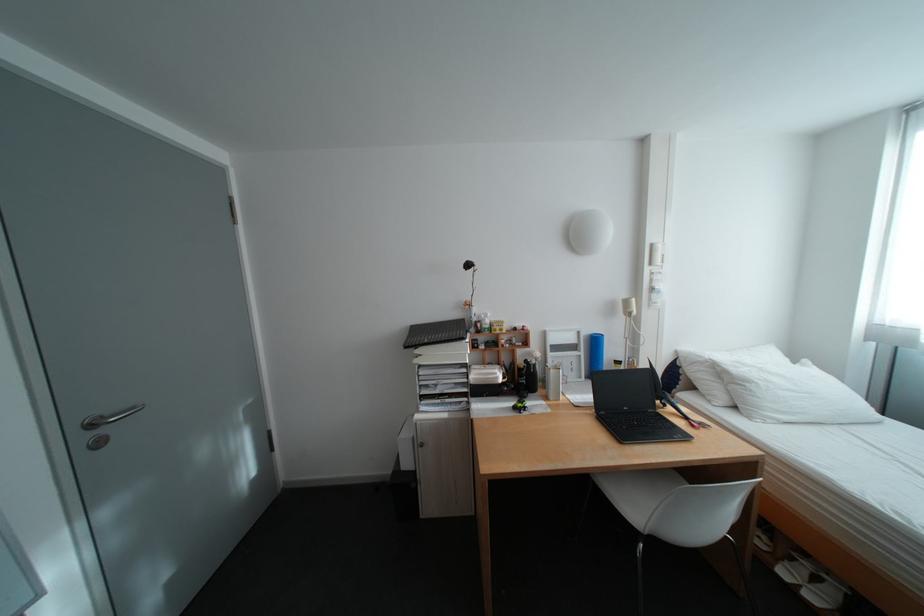
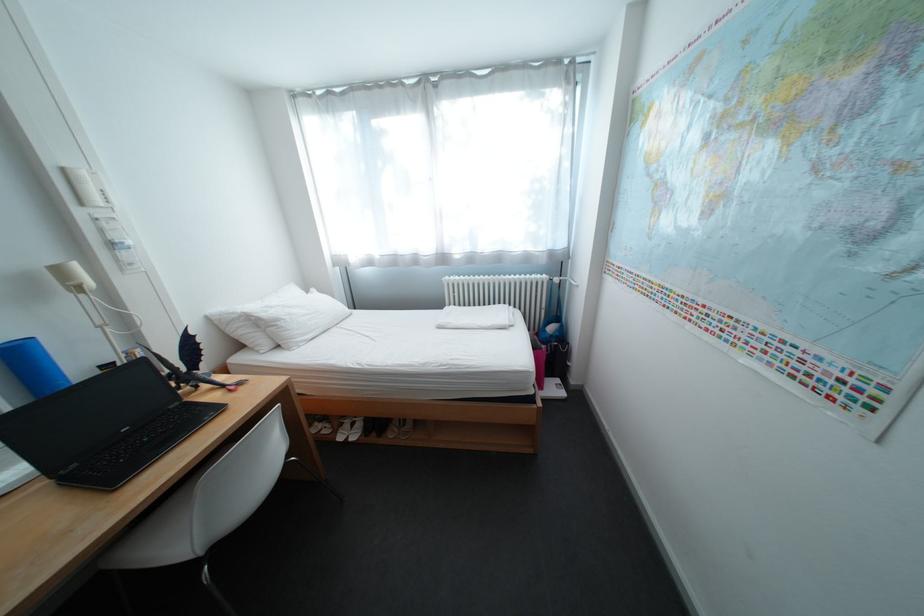
Where in the second image is the point corresponding to pixel 606 337 from the first image?

(17, 347)